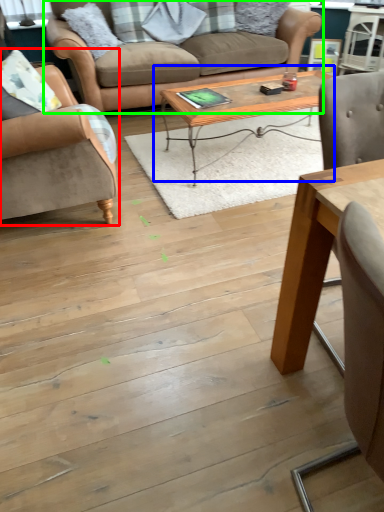
Question: Considering the real-world distances, which object is farthest from chair (highlighted by a red box)? coffee table (highlighted by a blue box) or studio couch (highlighted by a green box)?

Choices:
 (A) coffee table
 (B) studio couch

Answer: (B)